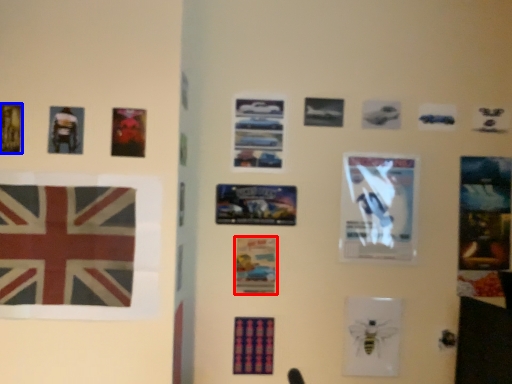
Question: Which of the following is the farthest to the observer, poster (highlighted by a red box) or poster (highlighted by a blue box)?

Choices:
 (A) poster
 (B) poster

Answer: (A)